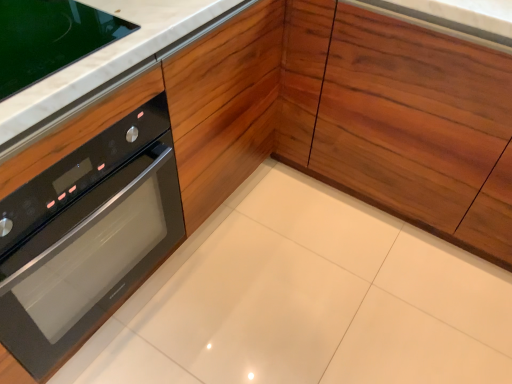
Question: Is black glass oven at left bigger than wooden at center?

Choices:
 (A) no
 (B) yes

Answer: (A)

Question: Does black glass oven at left touch wooden at center?

Choices:
 (A) no
 (B) yes

Answer: (A)

Question: Is the depth of black glass oven at left greater than that of wooden at center?

Choices:
 (A) no
 (B) yes

Answer: (A)

Question: Can you confirm if black glass oven at left is thinner than wooden at center?

Choices:
 (A) no
 (B) yes

Answer: (A)

Question: Is black glass oven at left smaller than wooden at center?

Choices:
 (A) yes
 (B) no

Answer: (A)

Question: Relative to white marble countertop at upper left, is black glass oven at left in front or behind?

Choices:
 (A) front
 (B) behind

Answer: (A)

Question: From a real-world perspective, is black glass oven at left physically located above or below white marble countertop at upper left?

Choices:
 (A) above
 (B) below

Answer: (B)

Question: Is point (69, 249) positioned closer to the camera than point (109, 54)?

Choices:
 (A) closer
 (B) farther

Answer: (B)

Question: In terms of width, does black glass oven at left look wider or thinner when compared to white marble countertop at upper left?

Choices:
 (A) thin
 (B) wide

Answer: (B)

Question: In the image, is black glass oven at left positioned in front of or behind wooden at center?

Choices:
 (A) behind
 (B) front

Answer: (B)

Question: Considering the positions of black glass oven at left and wooden at center in the image, is black glass oven at left wider or thinner than wooden at center?

Choices:
 (A) wide
 (B) thin

Answer: (A)

Question: Is point (48, 241) closer or farther from the camera than point (391, 201)?

Choices:
 (A) farther
 (B) closer

Answer: (B)

Question: Considering the positions of black glass oven at left and wooden at center in the image, is black glass oven at left taller or shorter than wooden at center?

Choices:
 (A) tall
 (B) short

Answer: (B)

Question: From the image's perspective, is wooden at center above or below white marble countertop at upper left?

Choices:
 (A) below
 (B) above

Answer: (B)

Question: From a real-world perspective, is wooden at center physically located above or below white marble countertop at upper left?

Choices:
 (A) above
 (B) below

Answer: (B)